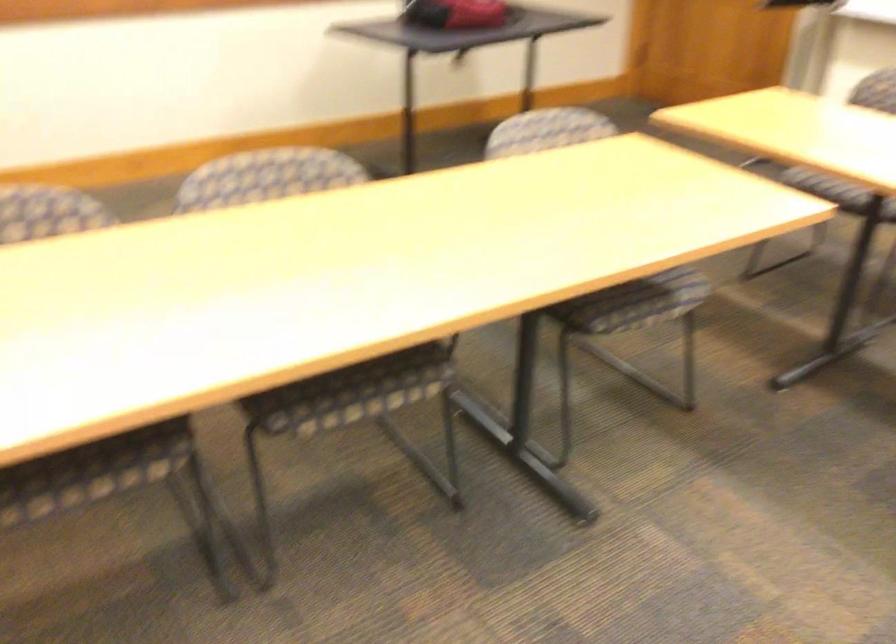
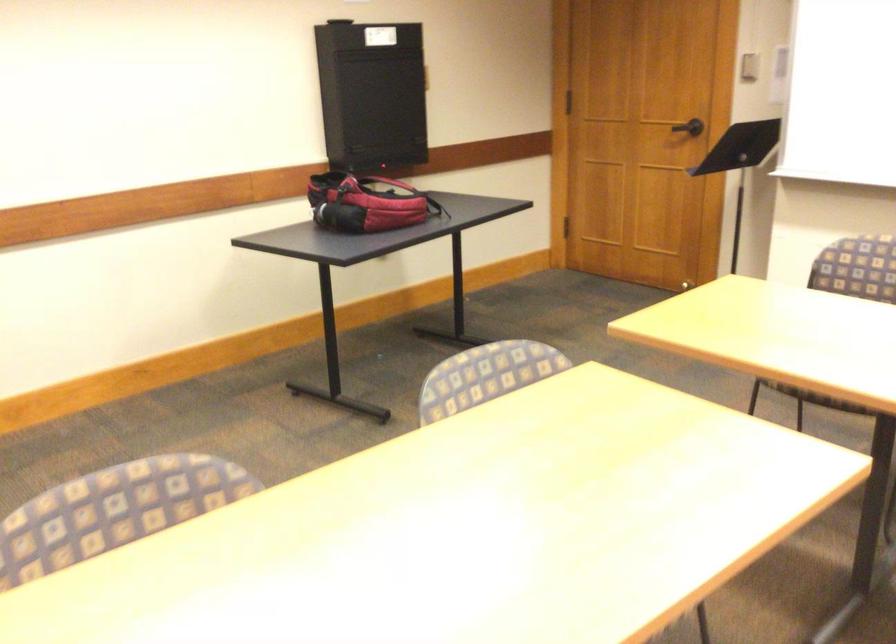
Question: I am providing you with two images of the same scene from different viewpoints. Which of the following objects are not visible in image2?

Choices:
 (A) red stamper
 (B) red and black bag
 (C) black door handle
 (D) patterned chair sitting surface

Answer: (D)